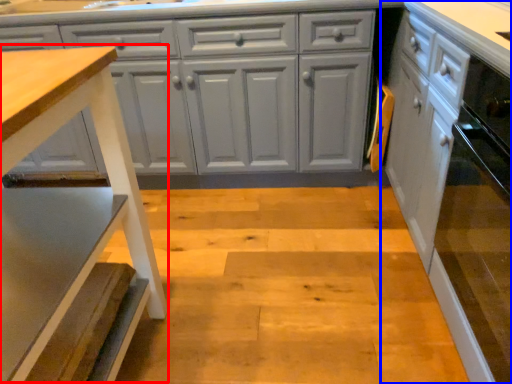
Question: Which of the following is the closest to the observer, step stool (highlighted by a red box) or cabinetry (highlighted by a blue box)?

Choices:
 (A) step stool
 (B) cabinetry

Answer: (A)